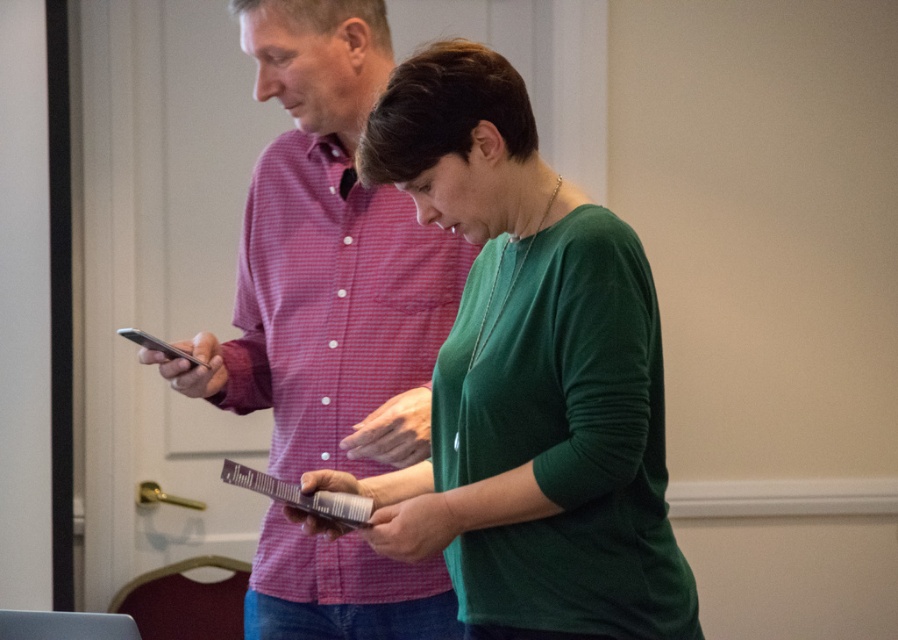
You are a tailor measuring two garments in a fitting room. The green matte cardigan at center and the matte pink shirt at center are both on a hanger. Which garment is shorter in height?

The green matte cardigan at center is not as tall as the matte pink shirt at center, so the green matte cardigan at center is shorter in height.

From the picture: Based on the coordinates provided in the scene description, where is the green matte cardigan at center located in the image?

The green matte cardigan at center is located at the coordinates point (527, 378) in the image.

You are an interior designer observing the two people in the image. You need to adjust their positions so that the matte pink shirt at center is now on the right side of the green matte cardigan at center. Which person should you move and in which direction?

The green matte cardigan at center is currently on the right side of the matte pink shirt at center. To switch their positions so that the matte pink shirt at center is on the right of the green matte cardigan at center, you should move the person wearing the green matte cardigan at center to the left side of the person in the matte pink shirt at center.